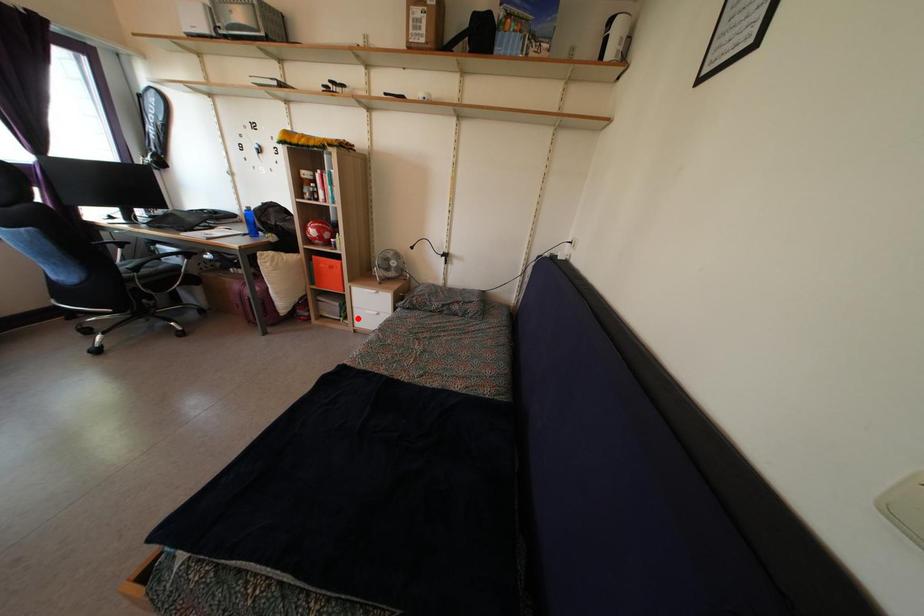
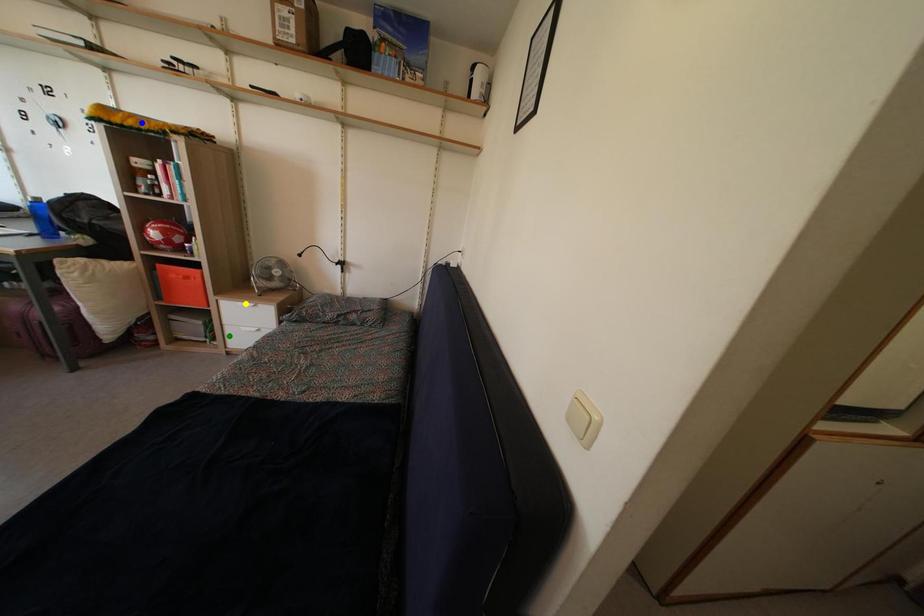
Question: I am providing you with two images of the same scene from different viewpoints. A red point is marked on the first image. You are given multiple points on the second image. Can you choose the point in image 2 that corresponds to the point in image 1?

Choices:
 (A) blue point
 (B) yellow point
 (C) green point

Answer: (C)